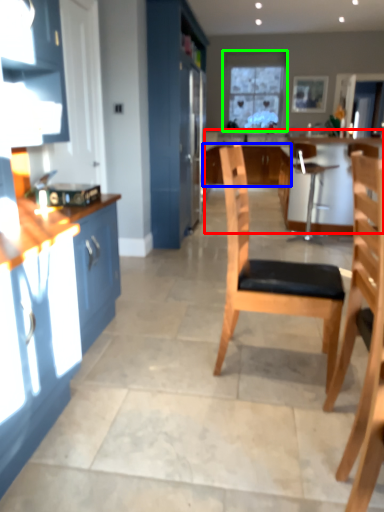
Question: Which is nearer to the counter (highlighted by a red box)? cabinetry (highlighted by a blue box) or window (highlighted by a green box).

Choices:
 (A) cabinetry
 (B) window

Answer: (A)